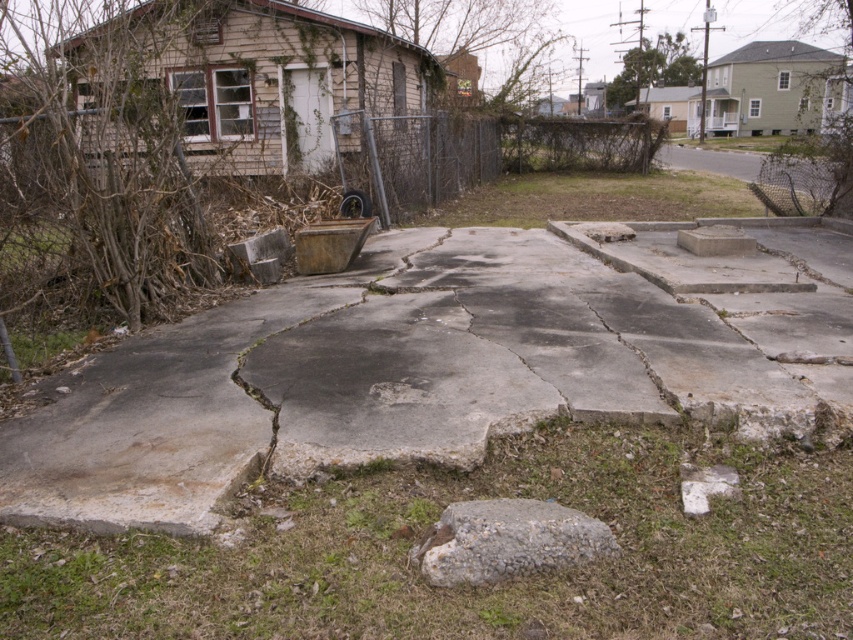
Question: Which point is closer to the camera taking this photo?

Choices:
 (A) (799, 408)
 (B) (717, 244)
 (C) (544, 547)

Answer: (C)

Question: Does gray concrete pavement at center have a larger size compared to gray concrete block at center?

Choices:
 (A) yes
 (B) no

Answer: (B)

Question: Can you confirm if gray concrete pavement at center is positioned to the left of gray concrete block at center?

Choices:
 (A) yes
 (B) no

Answer: (A)

Question: Considering the real-world distances, which object is farthest from the gray concrete block at center?

Choices:
 (A) gray concrete pavement at center
 (B) gray rough stone at lower center

Answer: (B)

Question: Which object is positioned farthest from the gray rough stone at lower center?

Choices:
 (A) gray concrete pavement at center
 (B) gray concrete block at center

Answer: (B)

Question: Can you confirm if gray concrete pavement at center is positioned below gray rough stone at lower center?

Choices:
 (A) yes
 (B) no

Answer: (B)